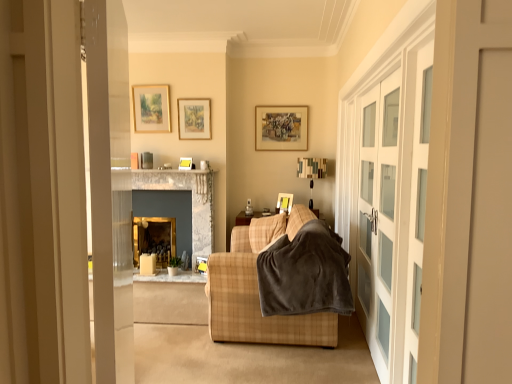
Question: Considering the relative positions of plaid fabric couch at center and velvety brown blanket at center in the image provided, is plaid fabric couch at center in front of velvety brown blanket at center?

Choices:
 (A) no
 (B) yes

Answer: (A)

Question: From the image's perspective, is plaid fabric couch at center over velvety brown blanket at center?

Choices:
 (A) yes
 (B) no

Answer: (B)

Question: Considering the relative sizes of plaid fabric couch at center and velvety brown blanket at center in the image provided, is plaid fabric couch at center smaller than velvety brown blanket at center?

Choices:
 (A) yes
 (B) no

Answer: (B)

Question: Is velvety brown blanket at center surrounded by plaid fabric couch at center?

Choices:
 (A) no
 (B) yes

Answer: (B)

Question: Are plaid fabric couch at center and velvety brown blanket at center making contact?

Choices:
 (A) no
 (B) yes

Answer: (A)

Question: Would you say plaid fabric couch at center is outside velvety brown blanket at center?

Choices:
 (A) no
 (B) yes

Answer: (B)

Question: Does velvety brown blanket at center appear on the right side of matte yellow picture frame at center, marked as the third picture frame in a bottom-to-top arrangement?

Choices:
 (A) yes
 (B) no

Answer: (A)

Question: From a real-world perspective, is velvety brown blanket at center positioned under matte yellow picture frame at center, marked as the third picture frame in a bottom-to-top arrangement, based on gravity?

Choices:
 (A) no
 (B) yes

Answer: (B)

Question: Is velvety brown blanket at center oriented towards matte yellow picture frame at center, the 2th picture frame viewed from the left?

Choices:
 (A) no
 (B) yes

Answer: (A)

Question: Is velvety brown blanket at center taller than matte yellow picture frame at center, the 2th picture frame viewed from the left?

Choices:
 (A) no
 (B) yes

Answer: (B)

Question: Does velvety brown blanket at center lie in front of matte yellow picture frame at center, which is counted as the 5th picture frame, starting from the right?

Choices:
 (A) yes
 (B) no

Answer: (A)

Question: From the image's perspective, is velvety brown blanket at center located above matte yellow picture frame at center, which is counted as the 5th picture frame, starting from the right?

Choices:
 (A) yes
 (B) no

Answer: (B)

Question: Does plaid fabric couch at center have a larger size compared to matte yellow picture frame at center, which is counted as the fifth picture frame, starting from the top?

Choices:
 (A) no
 (B) yes

Answer: (B)